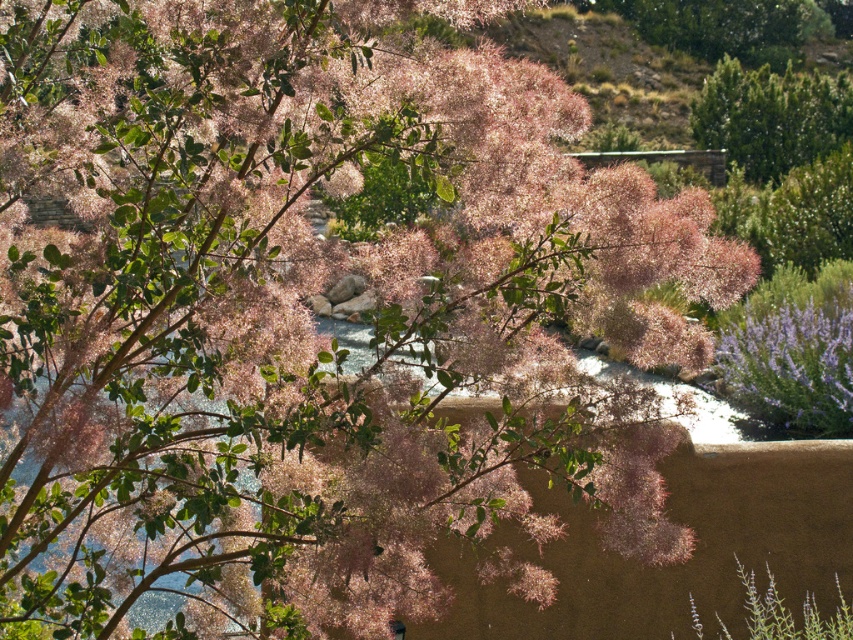
You are a gardener planning to water the purple fuzzy bush at lower right and the green matte bush at upper right. Which one should you water first if you want to start from the left side of the garden?

The purple fuzzy bush at lower right should be watered first because it is positioned to the left of the green matte bush at upper right.

You are standing at the center of the garden and want to find the purple fuzzy bush at lower right. Based on the coordinates provided, in which direction should you look to locate it?

The purple fuzzy bush at lower right is located at coordinates point (793, 364), which is in the lower right direction from your current position at the center of the garden.